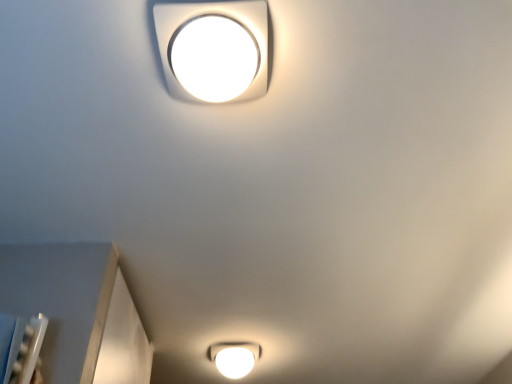
The height and width of the screenshot is (384, 512). What do you see at coordinates (234, 357) in the screenshot? I see `white glossy light fixture at bottom, acting as the second lamp starting from the top` at bounding box center [234, 357].

This screenshot has width=512, height=384. I want to click on white glossy light fixture at bottom, which is the first lamp from bottom to top, so coord(234,357).

Find the location of a particular element. white glossy square lamp at upper center, the second lamp from the bottom is located at coordinates (214, 50).

The image size is (512, 384). Describe the element at coordinates (214, 50) in the screenshot. I see `white glossy square lamp at upper center, the second lamp from the bottom` at that location.

Identify the location of white glossy light fixture at bottom, which is the first lamp from bottom to top. This screenshot has height=384, width=512. (234, 357).

Does white glossy square lamp at upper center, the first lamp when ordered from front to back, appear on the right side of white glossy light fixture at bottom, which is the first lamp from bottom to top?

Correct, you'll find white glossy square lamp at upper center, the first lamp when ordered from front to back, to the right of white glossy light fixture at bottom, which is the first lamp from bottom to top.

Which object is closer to the camera taking this photo, white glossy square lamp at upper center, the second lamp from the bottom, or white glossy light fixture at bottom, placed as the 1th lamp when sorted from back to front?

white glossy square lamp at upper center, the second lamp from the bottom.

Is point (208, 29) positioned before point (208, 352)?

Yes, it is.

From the image's perspective, between white glossy square lamp at upper center, the second lamp when ordered from back to front, and white glossy light fixture at bottom, which is the first lamp from bottom to top, who is located below?

From the image's view, white glossy light fixture at bottom, which is the first lamp from bottom to top, is below.

From a real-world perspective, is white glossy square lamp at upper center, the first lamp when ordered from front to back, physically below white glossy light fixture at bottom, which is the 2th lamp from front to back?

Correct, in the physical world, white glossy square lamp at upper center, the first lamp when ordered from front to back, is lower than white glossy light fixture at bottom, which is the 2th lamp from front to back.

Considering the relative sizes of white glossy square lamp at upper center, the second lamp when ordered from back to front, and white glossy light fixture at bottom, placed as the 1th lamp when sorted from back to front, in the image provided, is white glossy square lamp at upper center, the second lamp when ordered from back to front, wider than white glossy light fixture at bottom, placed as the 1th lamp when sorted from back to front,?

Incorrect, the width of white glossy square lamp at upper center, the second lamp when ordered from back to front, does not surpass that of white glossy light fixture at bottom, placed as the 1th lamp when sorted from back to front.

Who is taller, white glossy square lamp at upper center, the second lamp from the bottom, or white glossy light fixture at bottom, placed as the 1th lamp when sorted from back to front?

Standing taller between the two is white glossy light fixture at bottom, placed as the 1th lamp when sorted from back to front.

Consider the image. Which of these two, white glossy square lamp at upper center, the second lamp from the bottom, or white glossy light fixture at bottom, which is the 2th lamp from front to back, is bigger?

white glossy light fixture at bottom, which is the 2th lamp from front to back.

Do you think white glossy square lamp at upper center, the first lamp when ordered from front to back, is within white glossy light fixture at bottom, placed as the 1th lamp when sorted from back to front, or outside of it?

white glossy square lamp at upper center, the first lamp when ordered from front to back, is not inside white glossy light fixture at bottom, placed as the 1th lamp when sorted from back to front, it's outside.

Is white glossy square lamp at upper center, the 1th lamp viewed from the top, with white glossy light fixture at bottom, which is the first lamp from bottom to top?

There is a gap between white glossy square lamp at upper center, the 1th lamp viewed from the top, and white glossy light fixture at bottom, which is the first lamp from bottom to top.

Is white glossy square lamp at upper center, the first lamp when ordered from front to back, facing away from white glossy light fixture at bottom, which is the 2th lamp from front to back?

No, white glossy square lamp at upper center, the first lamp when ordered from front to back, is not facing the opposite direction of white glossy light fixture at bottom, which is the 2th lamp from front to back.

How far apart are white glossy square lamp at upper center, the 1th lamp viewed from the top, and white glossy light fixture at bottom, placed as the 1th lamp when sorted from back to front?

4.66 feet.

The width and height of the screenshot is (512, 384). In the image, there is a white glossy light fixture at bottom, which is the first lamp from bottom to top. Identify the location of lamp below it (from a real-world perspective). (214, 50).

Consider the image. Is white glossy light fixture at bottom, which is the first lamp from bottom to top, at the right side of white glossy square lamp at upper center, the first lamp when ordered from front to back?

No.

Is the position of white glossy light fixture at bottom, placed as the 1th lamp when sorted from back to front, more distant than that of white glossy square lamp at upper center, the second lamp when ordered from back to front?

Yes, white glossy light fixture at bottom, placed as the 1th lamp when sorted from back to front, is further from the camera.

Between point (229, 347) and point (261, 30), which one is positioned behind?

The point (229, 347) is farther from the camera.

From the image's perspective, who appears lower, white glossy light fixture at bottom, which is the first lamp from bottom to top, or white glossy square lamp at upper center, the first lamp when ordered from front to back?

white glossy light fixture at bottom, which is the first lamp from bottom to top, appears lower in the image.

From a real-world perspective, is white glossy light fixture at bottom, which is the 2th lamp from front to back, above or below white glossy square lamp at upper center, the second lamp when ordered from back to front?

In terms of real-world spatial position, white glossy light fixture at bottom, which is the 2th lamp from front to back, is above white glossy square lamp at upper center, the second lamp when ordered from back to front.

Is white glossy light fixture at bottom, which is the first lamp from bottom to top, wider than white glossy square lamp at upper center, the second lamp from the bottom?

Yes, white glossy light fixture at bottom, which is the first lamp from bottom to top, is wider than white glossy square lamp at upper center, the second lamp from the bottom.

Considering the sizes of objects white glossy light fixture at bottom, acting as the second lamp starting from the top, and white glossy square lamp at upper center, the 1th lamp viewed from the top, in the image provided, who is taller, white glossy light fixture at bottom, acting as the second lamp starting from the top, or white glossy square lamp at upper center, the 1th lamp viewed from the top,?

With more height is white glossy light fixture at bottom, acting as the second lamp starting from the top.

Considering the relative sizes of white glossy light fixture at bottom, which is the first lamp from bottom to top, and white glossy square lamp at upper center, the second lamp when ordered from back to front, in the image provided, is white glossy light fixture at bottom, which is the first lamp from bottom to top, bigger than white glossy square lamp at upper center, the second lamp when ordered from back to front,?

Correct, white glossy light fixture at bottom, which is the first lamp from bottom to top, is larger in size than white glossy square lamp at upper center, the second lamp when ordered from back to front.

Is white glossy light fixture at bottom, which is the first lamp from bottom to top, located outside white glossy square lamp at upper center, the first lamp when ordered from front to back?

Yes, white glossy light fixture at bottom, which is the first lamp from bottom to top, is located beyond the bounds of white glossy square lamp at upper center, the first lamp when ordered from front to back.

Is white glossy light fixture at bottom, acting as the second lamp starting from the top, placed right next to white glossy square lamp at upper center, the second lamp from the bottom?

No, white glossy light fixture at bottom, acting as the second lamp starting from the top, is not beside white glossy square lamp at upper center, the second lamp from the bottom.

Is white glossy light fixture at bottom, acting as the second lamp starting from the top, oriented towards white glossy square lamp at upper center, the first lamp when ordered from front to back?

No, white glossy light fixture at bottom, acting as the second lamp starting from the top, does not turn towards white glossy square lamp at upper center, the first lamp when ordered from front to back.

Can you tell me how much white glossy light fixture at bottom, which is the 2th lamp from front to back, and white glossy square lamp at upper center, the second lamp when ordered from back to front, differ in facing direction?

90 degrees.

How much distance is there between white glossy light fixture at bottom, which is the first lamp from bottom to top, and white glossy square lamp at upper center, the 1th lamp viewed from the top?

white glossy light fixture at bottom, which is the first lamp from bottom to top, is 4.66 feet away from white glossy square lamp at upper center, the 1th lamp viewed from the top.

Identify the location of lamp on the right of white glossy light fixture at bottom, acting as the second lamp starting from the top. This screenshot has width=512, height=384. (214, 50).

What are the coordinates of `lamp lying on the left of white glossy square lamp at upper center, the 1th lamp viewed from the top` in the screenshot? It's located at (234, 357).

Image resolution: width=512 pixels, height=384 pixels. I want to click on lamp above the white glossy light fixture at bottom, which is the first lamp from bottom to top (from the image's perspective), so click(x=214, y=50).